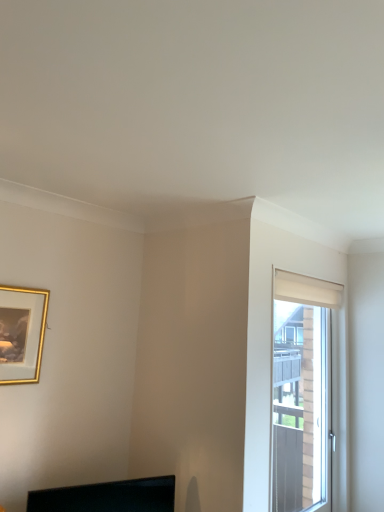
Question: Is white matte window at right not near black glossy monitor at lower center?

Choices:
 (A) yes
 (B) no

Answer: (A)

Question: Is white matte window at right thinner than black glossy monitor at lower center?

Choices:
 (A) yes
 (B) no

Answer: (B)

Question: From the image's perspective, would you say white matte window at right is positioned over black glossy monitor at lower center?

Choices:
 (A) yes
 (B) no

Answer: (A)

Question: Is white matte window at right oriented away from black glossy monitor at lower center?

Choices:
 (A) yes
 (B) no

Answer: (B)

Question: Is white matte window at right at the left side of black glossy monitor at lower center?

Choices:
 (A) yes
 (B) no

Answer: (B)

Question: From a real-world perspective, is gold-framed picture at upper left above or below white matte window at right?

Choices:
 (A) above
 (B) below

Answer: (A)

Question: Looking at the image, does gold-framed picture at upper left seem bigger or smaller compared to white matte window at right?

Choices:
 (A) small
 (B) big

Answer: (A)

Question: Considering their positions, is gold-framed picture at upper left located in front of or behind white matte window at right?

Choices:
 (A) behind
 (B) front

Answer: (B)

Question: Is gold-framed picture at upper left inside or outside of white matte window at right?

Choices:
 (A) inside
 (B) outside

Answer: (B)

Question: From the image's perspective, relative to gold-framed picture at upper left, is white matte window at right above or below?

Choices:
 (A) below
 (B) above

Answer: (A)

Question: In terms of width, does white matte window at right look wider or thinner when compared to gold-framed picture at upper left?

Choices:
 (A) thin
 (B) wide

Answer: (B)

Question: In terms of height, does white matte window at right look taller or shorter compared to gold-framed picture at upper left?

Choices:
 (A) tall
 (B) short

Answer: (A)

Question: From a real-world perspective, is white matte window at right above or below gold-framed picture at upper left?

Choices:
 (A) below
 (B) above

Answer: (A)

Question: Would you say black glossy monitor at lower center is inside or outside white matte window at right?

Choices:
 (A) outside
 (B) inside

Answer: (A)

Question: In terms of size, does black glossy monitor at lower center appear bigger or smaller than white matte window at right?

Choices:
 (A) big
 (B) small

Answer: (B)